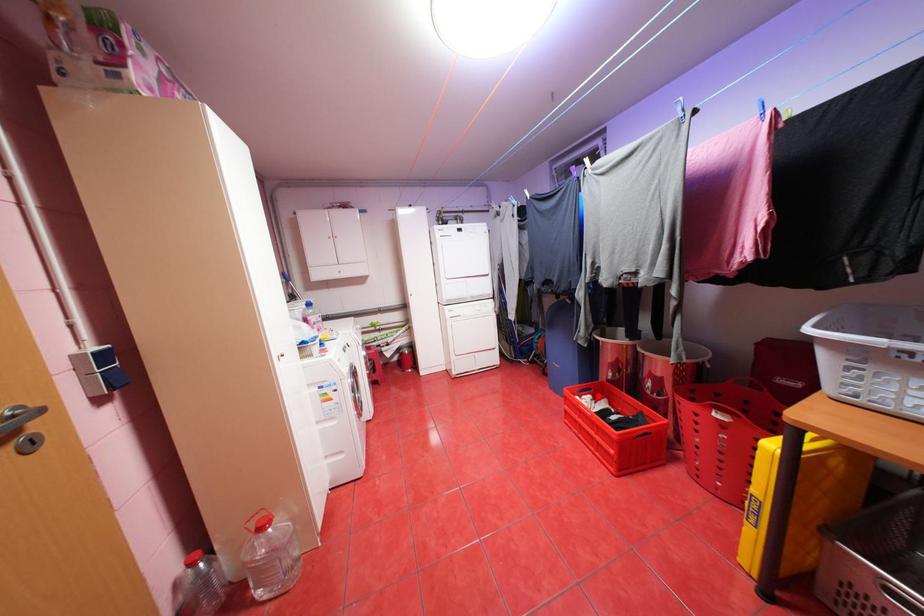
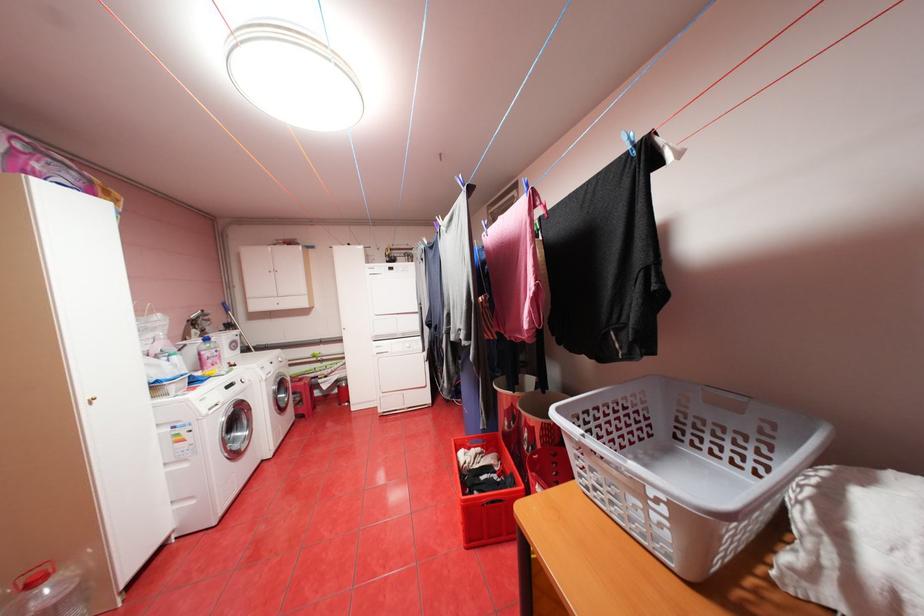
Question: I am providing you with two images of the same scene from different viewpoints. A red point is shown in image1. For the corresponding object point in image2, is it positioned nearer or farther from the camera?

Choices:
 (A) Nearer
 (B) Farther

Answer: (B)